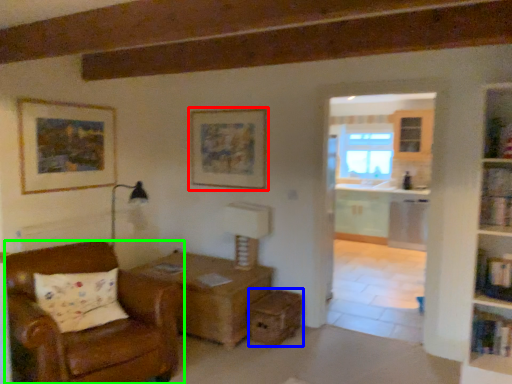
Question: Which is nearer to the picture frame (highlighted by a red box)? drawer (highlighted by a blue box) or chair (highlighted by a green box).

Choices:
 (A) drawer
 (B) chair

Answer: (A)